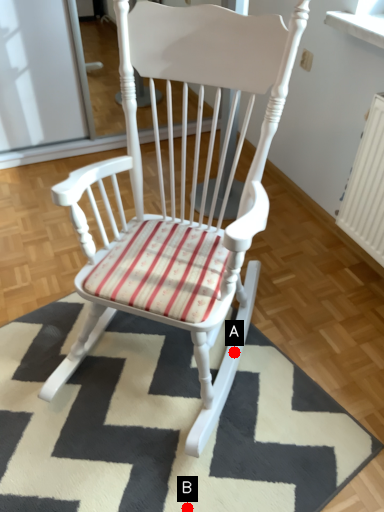
Question: Two points are circled on the image, labeled by A and B beside each circle. Which point is closer to the camera?

Choices:
 (A) A is closer
 (B) B is closer

Answer: (B)